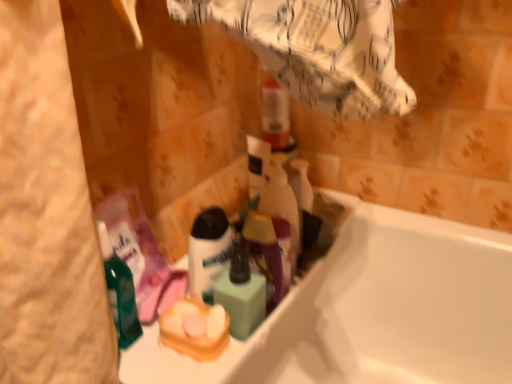
Question: Considering the relative sizes of white glossy bathtub at lower right and green matte mouthwash at center in the image provided, is white glossy bathtub at lower right taller than green matte mouthwash at center?

Choices:
 (A) no
 (B) yes

Answer: (B)

Question: Is white glossy bathtub at lower right at the right side of green matte mouthwash at center?

Choices:
 (A) yes
 (B) no

Answer: (A)

Question: From the image's perspective, is white glossy bathtub at lower right located beneath green matte mouthwash at center?

Choices:
 (A) no
 (B) yes

Answer: (B)

Question: Does white glossy bathtub at lower right appear on the left side of green matte mouthwash at center?

Choices:
 (A) no
 (B) yes

Answer: (A)

Question: Considering the relative sizes of white glossy bathtub at lower right and green matte mouthwash at center in the image provided, is white glossy bathtub at lower right bigger than green matte mouthwash at center?

Choices:
 (A) no
 (B) yes

Answer: (B)

Question: Does white glossy bathtub at lower right have a lesser width compared to green matte mouthwash at center?

Choices:
 (A) yes
 (B) no

Answer: (B)

Question: Is yellow sponge at center at the back of green matte mouthwash at center?

Choices:
 (A) yes
 (B) no

Answer: (B)

Question: Is green matte mouthwash at center thinner than yellow sponge at center?

Choices:
 (A) yes
 (B) no

Answer: (A)

Question: Is green matte mouthwash at center positioned behind yellow sponge at center?

Choices:
 (A) no
 (B) yes

Answer: (B)

Question: Are green matte mouthwash at center and yellow sponge at center located far from each other?

Choices:
 (A) no
 (B) yes

Answer: (A)

Question: From a real-world perspective, does green matte mouthwash at center sit lower than yellow sponge at center?

Choices:
 (A) yes
 (B) no

Answer: (B)

Question: Does green matte mouthwash at center have a larger size compared to yellow sponge at center?

Choices:
 (A) no
 (B) yes

Answer: (B)

Question: From the image's perspective, is green matte mouthwash at center located beneath translucent purple spray bottle at center?

Choices:
 (A) no
 (B) yes

Answer: (B)